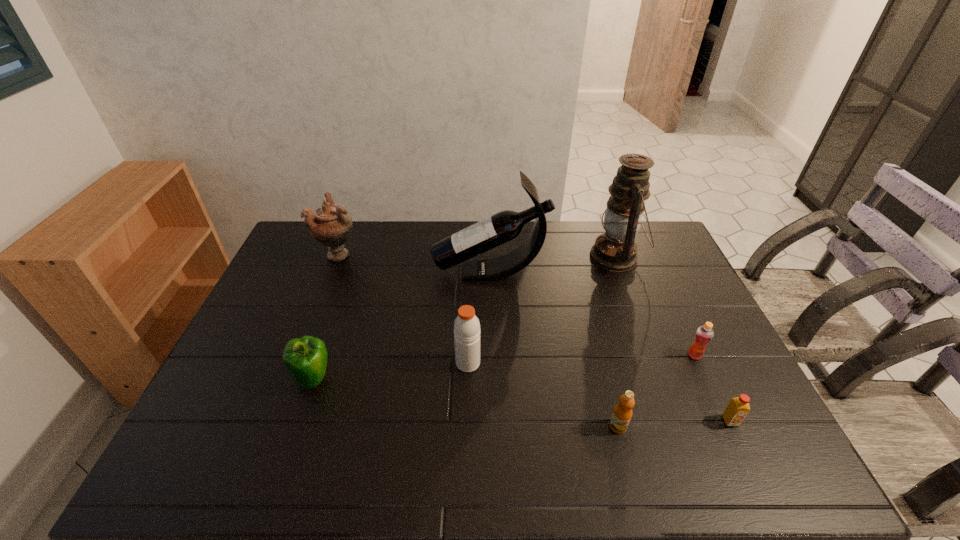
Locate an element on the screen. blank area located 0.050m on the stand of the wine bottle is located at coordinates (418, 273).

Where is `vacant space located on the stand of the wine bottle`? This screenshot has height=540, width=960. vacant space located on the stand of the wine bottle is located at coordinates (412, 273).

At what (x,y) coordinates should I click in order to perform the action: click on free space located on the left of the urn. Please return your answer as a coordinate pair (x, y). This screenshot has height=540, width=960. Looking at the image, I should click on (294, 254).

The width and height of the screenshot is (960, 540). In order to click on free space located on the left of the shaker in this screenshot , I will do click(x=361, y=363).

Where is `free space located on the left of the fifth tallest object`? The width and height of the screenshot is (960, 540). free space located on the left of the fifth tallest object is located at coordinates (219, 378).

Find the location of a particular element. This screenshot has width=960, height=540. free region located 0.110m on the front label of the leftmost orange juice is located at coordinates (632, 480).

At what (x,y) coordinates should I click in order to perform the action: click on free space located on the left of the farthest orange juice. Please return your answer as a coordinate pair (x, y). Looking at the image, I should click on (590, 355).

At what (x,y) coordinates should I click in order to perform the action: click on vacant position located on the front and back of the shortest object. Please return your answer as a coordinate pair (x, y). The image size is (960, 540). Looking at the image, I should click on (756, 477).

Identify the location of lantern that is at the far edge. The image size is (960, 540). (615, 250).

At what (x,y) coordinates should I click in order to perform the action: click on urn that is positioned at the far edge. Please return your answer as a coordinate pair (x, y). The image size is (960, 540). Looking at the image, I should click on (330, 225).